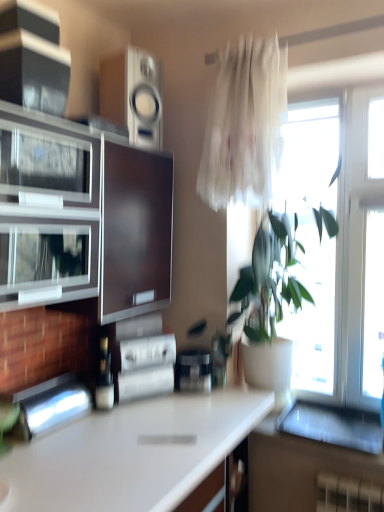
What is the approximate height of black glossy speaker at upper left, marked as the 4th appliance in a bottom-to-top arrangement?

The height of black glossy speaker at upper left, marked as the 4th appliance in a bottom-to-top arrangement, is 10.26 inches.

Find the location of a particular element. This screenshot has width=384, height=512. black glossy speaker at upper left, marked as the 4th appliance in a bottom-to-top arrangement is located at coordinates (35, 75).

The height and width of the screenshot is (512, 384). What are the coordinates of `white glossy computer desk at lower right` in the screenshot? It's located at (298, 468).

The image size is (384, 512). In order to click on shiny metallic bottle at center in this screenshot , I will do `click(104, 378)`.

From the white glossy countertop at center, count 5th appliances backward and point to it. Please provide its 2D coordinates.

[(193, 370)]

Is point (175, 483) less distant than point (186, 382)?

Yes, it is.

Considering the relative positions of white glossy countertop at center and satin black coffee maker at center, the 2th appliance positioned from the bottom, in the image provided, is white glossy countertop at center to the right of satin black coffee maker at center, the 2th appliance positioned from the bottom, from the viewer's perspective?

No, white glossy countertop at center is not to the right of satin black coffee maker at center, the 2th appliance positioned from the bottom.

Based on their positions, is translucent white curtain at upper right located to the left or right of metallic stainless steel toaster at lower left, which is the 5th appliance from top to bottom?

From the image, it's evident that translucent white curtain at upper right is to the right of metallic stainless steel toaster at lower left, which is the 5th appliance from top to bottom.

Is translucent white curtain at upper right taller than metallic stainless steel toaster at lower left, which ranks as the first appliance in bottom-to-top order?

Yes.

From a real-world perspective, is translucent white curtain at upper right under metallic stainless steel toaster at lower left, which is the 5th appliance from top to bottom?

No, from a real-world perspective, translucent white curtain at upper right is not beneath metallic stainless steel toaster at lower left, which is the 5th appliance from top to bottom.

Is translucent white curtain at upper right situated inside metallic stainless steel toaster at lower left, which is the 5th appliance from top to bottom, or outside?

translucent white curtain at upper right cannot be found inside metallic stainless steel toaster at lower left, which is the 5th appliance from top to bottom.

Which is nearer, (x=162, y=460) or (x=315, y=501)?

Point (x=162, y=460).

From a real-world perspective, which object rests below the other?

white glossy countertop at center.

Does white glossy countertop at center have a smaller size compared to white glossy computer desk at lower right?

No.

Measure the distance between white glossy countertop at center and white glossy computer desk at lower right.

The distance of white glossy countertop at center from white glossy computer desk at lower right is 56.68 centimeters.

Is white glossy countertop at center turned away from shiny metallic bottle at center?

No, white glossy countertop at center's orientation is not away from shiny metallic bottle at center.

From the picture: Does white glossy countertop at center have a greater width compared to shiny metallic bottle at center?

Correct, the width of white glossy countertop at center exceeds that of shiny metallic bottle at center.

Are white glossy countertop at center and shiny metallic bottle at center beside each other?

They are not placed beside each other.

From a real-world perspective, is white glossy countertop at center below shiny metallic bottle at center?

Indeed, from a real-world perspective, white glossy countertop at center is positioned beneath shiny metallic bottle at center.

From the image's perspective, is satin black coffee maker at center, arranged as the fourth appliance when viewed from the top, beneath metallic stainless steel toaster at lower left, which is the 5th appliance from top to bottom?

No, from the image's perspective, satin black coffee maker at center, arranged as the fourth appliance when viewed from the top, is not below metallic stainless steel toaster at lower left, which is the 5th appliance from top to bottom.

Which of these two, satin black coffee maker at center, arranged as the fourth appliance when viewed from the top, or metallic stainless steel toaster at lower left, which is the 5th appliance from top to bottom, is smaller?

satin black coffee maker at center, arranged as the fourth appliance when viewed from the top, is smaller.

In terms of height, does satin black coffee maker at center, arranged as the fourth appliance when viewed from the top, look taller or shorter compared to metallic stainless steel toaster at lower left, which ranks as the first appliance in bottom-to-top order?

Considering their sizes, satin black coffee maker at center, arranged as the fourth appliance when viewed from the top, has more height than metallic stainless steel toaster at lower left, which ranks as the first appliance in bottom-to-top order.

In terms of width, does satin black coffee maker at center, the 2th appliance positioned from the bottom, look wider or thinner when compared to metallic stainless steel toaster at lower left, which ranks as the first appliance in bottom-to-top order?

Considering their sizes, satin black coffee maker at center, the 2th appliance positioned from the bottom, looks slimmer than metallic stainless steel toaster at lower left, which ranks as the first appliance in bottom-to-top order.

From a real-world perspective, is metallic stainless steel toaster at lower left, which is the 5th appliance from top to bottom, positioned above or below silver metallic speaker at upper center, positioned as the 1th appliance in top-to-bottom order?

metallic stainless steel toaster at lower left, which is the 5th appliance from top to bottom, is situated lower than silver metallic speaker at upper center, positioned as the 1th appliance in top-to-bottom order, in the real world.

From the image's perspective, is metallic stainless steel toaster at lower left, which is the 5th appliance from top to bottom, under silver metallic speaker at upper center, positioned as the 1th appliance in top-to-bottom order?

Correct, metallic stainless steel toaster at lower left, which is the 5th appliance from top to bottom, appears lower than silver metallic speaker at upper center, positioned as the 1th appliance in top-to-bottom order, in the image.

Does metallic stainless steel toaster at lower left, which is the 5th appliance from top to bottom, come behind silver metallic speaker at upper center, positioned as the 1th appliance in top-to-bottom order?

That is False.

Is point (51, 420) less distant than point (154, 111)?

Yes, it is.

Can you confirm if translucent white curtain at upper right is positioned to the left of shiny metallic bottle at center?

In fact, translucent white curtain at upper right is to the right of shiny metallic bottle at center.

From the image's perspective, which is below, translucent white curtain at upper right or shiny metallic bottle at center?

From the image's view, shiny metallic bottle at center is below.

Measure the distance between translucent white curtain at upper right and shiny metallic bottle at center.

They are 1.05 meters apart.

Is shiny metallic bottle at center located within translucent white curtain at upper right?

No, shiny metallic bottle at center is not inside translucent white curtain at upper right.

Where is `countertop below the satin black coffee maker at center, arranged as the fourth appliance when viewed from the top (from the image's perspective)`? countertop below the satin black coffee maker at center, arranged as the fourth appliance when viewed from the top (from the image's perspective) is located at coordinates point(133,453).

In order to click on curtain that is on the right side of metallic stainless steel toaster at lower left, which is the 5th appliance from top to bottom in this screenshot , I will do `click(244, 125)`.

When comparing their distances from white glossy computer desk at lower right, does white glossy countertop at center or matte brown cabinet at left seem closer?

white glossy countertop at center.

Looking at the image, which one is located further to silver metallic speaker at upper center, positioned as the 1th appliance in top-to-bottom order, black glossy speaker at upper left, acting as the second appliance starting from the top, or metallic silver toaster at center, acting as the 3th appliance starting from the bottom?

Based on the image, metallic silver toaster at center, acting as the 3th appliance starting from the bottom, appears to be further to silver metallic speaker at upper center, positioned as the 1th appliance in top-to-bottom order.

Considering their positions, is satin black coffee maker at center, arranged as the fourth appliance when viewed from the top, positioned further to white glossy countertop at center than silver metallic speaker at upper center, the fifth appliance ordered from the bottom?

silver metallic speaker at upper center, the fifth appliance ordered from the bottom.

Based on their spatial positions, is satin black coffee maker at center, arranged as the fourth appliance when viewed from the top, or metallic silver toaster at center, acting as the 3th appliance starting from the bottom, closer to metallic stainless steel toaster at lower left, which ranks as the first appliance in bottom-to-top order?

Among the two, metallic silver toaster at center, acting as the 3th appliance starting from the bottom, is located nearer to metallic stainless steel toaster at lower left, which ranks as the first appliance in bottom-to-top order.

Considering their positions, is transparent glass window at right positioned closer to satin black coffee maker at center, the 2th appliance positioned from the bottom, than matte brown cabinet at left?

The object closer to satin black coffee maker at center, the 2th appliance positioned from the bottom, is matte brown cabinet at left.

Based on their spatial positions, is silver metallic speaker at upper center, positioned as the 1th appliance in top-to-bottom order, or satin black coffee maker at center, the 2th appliance positioned from the bottom, closer to black glossy speaker at upper left, marked as the 4th appliance in a bottom-to-top arrangement?

The object closer to black glossy speaker at upper left, marked as the 4th appliance in a bottom-to-top arrangement, is silver metallic speaker at upper center, positioned as the 1th appliance in top-to-bottom order.

Looking at the image, which one is located further to black glossy speaker at upper left, acting as the second appliance starting from the top, metallic silver toaster at center, acting as the 3th appliance starting from the bottom, or transparent glass window at right?

transparent glass window at right is further to black glossy speaker at upper left, acting as the second appliance starting from the top.

Which object lies further to the anchor point silver metallic speaker at upper center, positioned as the 1th appliance in top-to-bottom order, translucent white curtain at upper right or metallic stainless steel toaster at lower left, which is the 5th appliance from top to bottom?

metallic stainless steel toaster at lower left, which is the 5th appliance from top to bottom, is positioned further to the anchor silver metallic speaker at upper center, positioned as the 1th appliance in top-to-bottom order.

The height and width of the screenshot is (512, 384). I want to click on window that lies between translucent white curtain at upper right and white glossy computer desk at lower right from top to bottom, so click(x=338, y=247).

Find the location of `window between black glossy speaker at upper left, marked as the 4th appliance in a bottom-to-top arrangement, and white glossy computer desk at lower right from top to bottom`. window between black glossy speaker at upper left, marked as the 4th appliance in a bottom-to-top arrangement, and white glossy computer desk at lower right from top to bottom is located at coordinates (338, 247).

Identify the location of cabinetry that lies between translucent white curtain at upper right and metallic silver toaster at center, arranged as the 3th appliance when viewed from the top, from top to bottom. (82, 217).

Where is `window between silver metallic speaker at upper center, the fifth appliance ordered from the bottom, and white glossy computer desk at lower right in the up-down direction`? The image size is (384, 512). window between silver metallic speaker at upper center, the fifth appliance ordered from the bottom, and white glossy computer desk at lower right in the up-down direction is located at coordinates (338, 247).